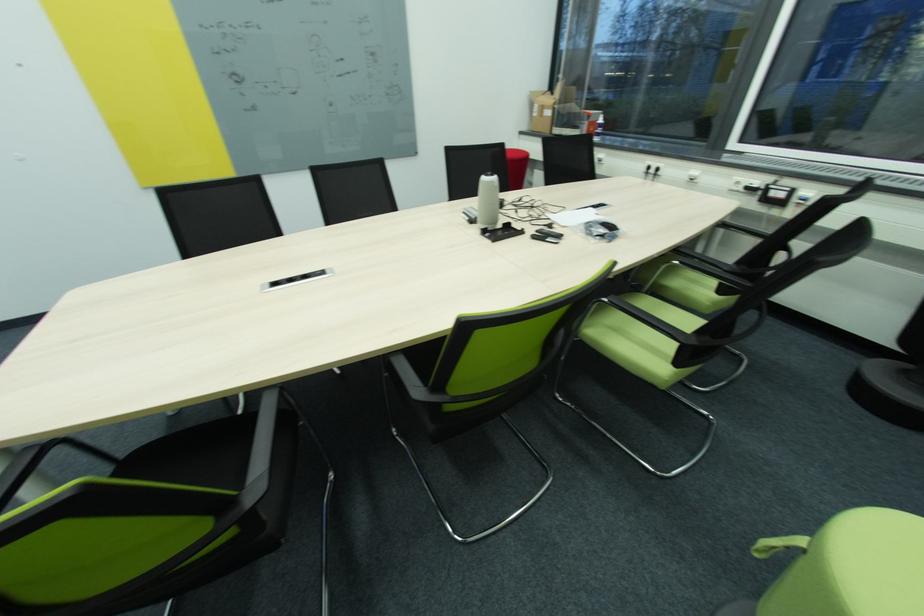
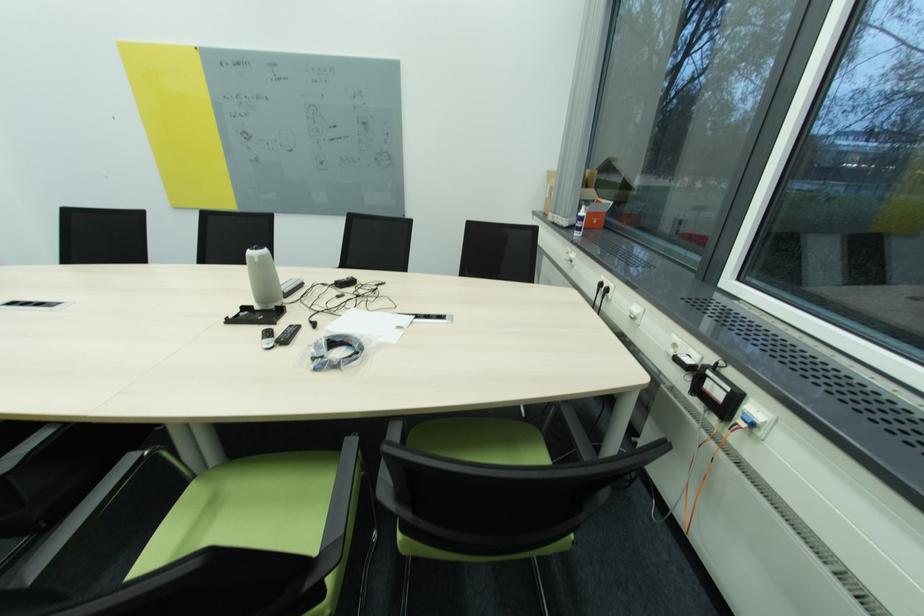
Where in the second image is the point corresponding to (652,169) from the first image?

(604, 286)